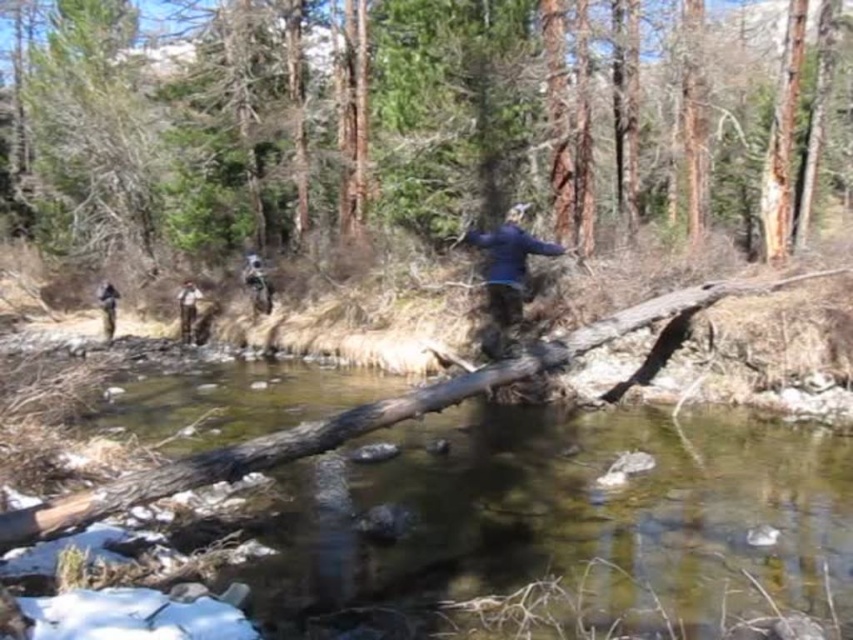
This screenshot has height=640, width=853. Describe the element at coordinates (563, 520) in the screenshot. I see `transparent water at center` at that location.

Does transparent water at center have a lesser height compared to dark blue jacket at center?

Yes, transparent water at center is shorter than dark blue jacket at center.

Between point (645, 429) and point (258, 262), which one is positioned behind?

Point (258, 262)

The height and width of the screenshot is (640, 853). I want to click on transparent water at center, so click(563, 520).

Measure the distance between point (84, 8) and camera.

Point (84, 8) and camera are 17.96 meters apart.

Does point (329, 49) come farther from viewer compared to point (180, 328)?

That is True.

Where is `brown rough log at center`? brown rough log at center is located at coordinates (407, 124).

Is point (381, 630) positioned in front of point (502, 326)?

Yes, point (381, 630) is in front of point (502, 326).

Who is higher up, transparent water at center or blue matte jacket at center?

blue matte jacket at center is higher up.

I want to click on transparent water at center, so click(x=563, y=520).

This screenshot has height=640, width=853. I want to click on transparent water at center, so click(563, 520).